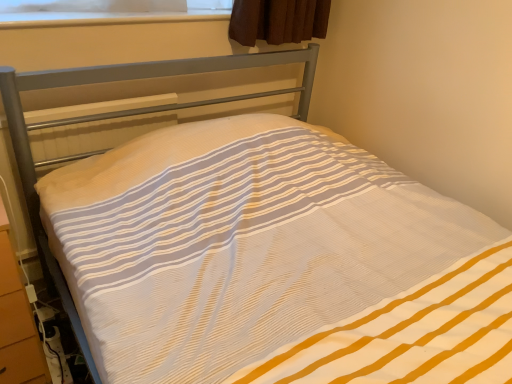
Question: Is orange wood dresser at lower left positioned beyond the bounds of transparent plastic at upper center?

Choices:
 (A) no
 (B) yes

Answer: (B)

Question: From the image's perspective, is orange wood dresser at lower left under transparent plastic at upper center?

Choices:
 (A) no
 (B) yes

Answer: (B)

Question: Is orange wood dresser at lower left positioned before transparent plastic at upper center?

Choices:
 (A) yes
 (B) no

Answer: (A)

Question: Is the depth of orange wood dresser at lower left greater than that of transparent plastic at upper center?

Choices:
 (A) yes
 (B) no

Answer: (B)

Question: Can you confirm if orange wood dresser at lower left is taller than transparent plastic at upper center?

Choices:
 (A) no
 (B) yes

Answer: (B)

Question: Is orange wood dresser at lower left looking in the opposite direction of transparent plastic at upper center?

Choices:
 (A) no
 (B) yes

Answer: (A)

Question: Are transparent plastic at upper center and orange wood dresser at lower left far apart?

Choices:
 (A) yes
 (B) no

Answer: (B)

Question: Is transparent plastic at upper center to the right of orange wood dresser at lower left from the viewer's perspective?

Choices:
 (A) no
 (B) yes

Answer: (B)

Question: Would you say orange wood dresser at lower left is part of transparent plastic at upper center's contents?

Choices:
 (A) yes
 (B) no

Answer: (B)

Question: Is transparent plastic at upper center shorter than orange wood dresser at lower left?

Choices:
 (A) no
 (B) yes

Answer: (B)

Question: From the image's perspective, is transparent plastic at upper center below orange wood dresser at lower left?

Choices:
 (A) no
 (B) yes

Answer: (A)

Question: Considering the relative positions of transparent plastic at upper center and orange wood dresser at lower left in the image provided, is transparent plastic at upper center in front of orange wood dresser at lower left?

Choices:
 (A) yes
 (B) no

Answer: (B)

Question: Considering the relative positions of orange wood dresser at lower left and transparent plastic at upper center in the image provided, is orange wood dresser at lower left to the left or to the right of transparent plastic at upper center?

Choices:
 (A) left
 (B) right

Answer: (A)